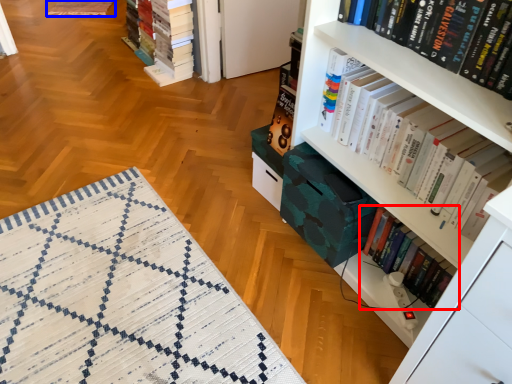
Question: Which object appears closest to the camera in this image, book (highlighted by a red box) or quilt (highlighted by a blue box)?

Choices:
 (A) book
 (B) quilt

Answer: (A)